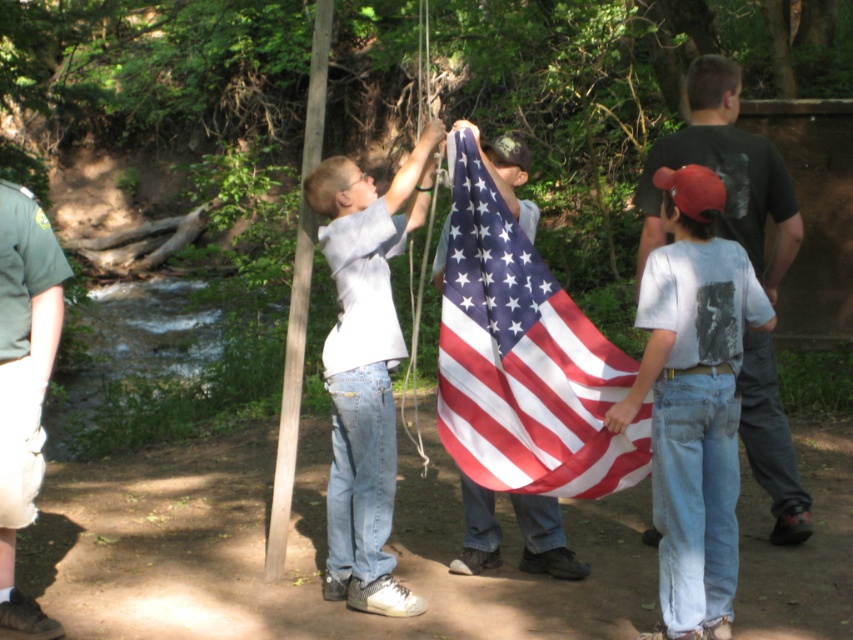
Based on the scene description, can you determine the spatial relationship between the american flag at center and the denim jeans at center?

The american flag at center is located above denim jeans at center.

You are a photographer at the flag ceremony. You need to capture a photo where the american flag at center and the smooth wooden pole at center are both visible. Which object will appear larger in the photo?

The american flag at center will appear larger in the photo because it is bigger than the smooth wooden pole at center.